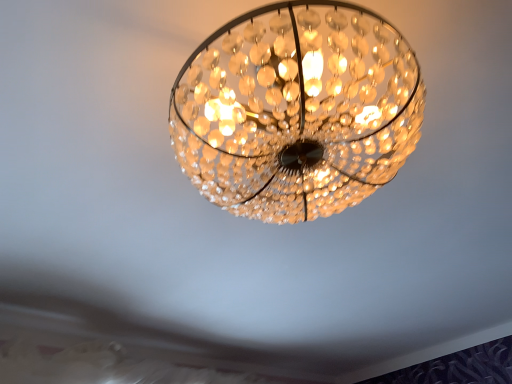
What do you see at coordinates (297, 110) in the screenshot? I see `translucent glass chandelier at center` at bounding box center [297, 110].

Find the location of a particular element. translucent glass chandelier at center is located at coordinates (297, 110).

Image resolution: width=512 pixels, height=384 pixels. Find the location of `translucent glass chandelier at center`. translucent glass chandelier at center is located at coordinates (297, 110).